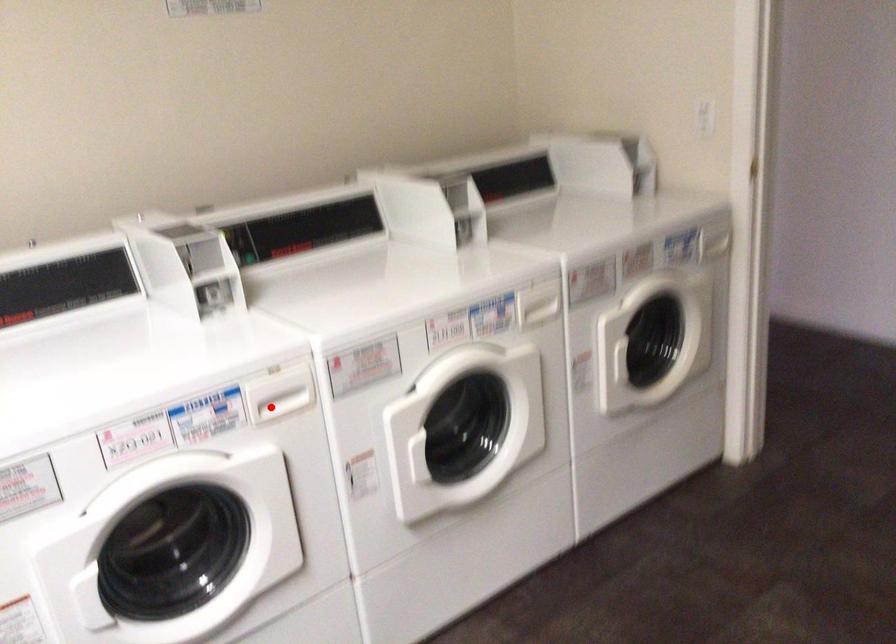
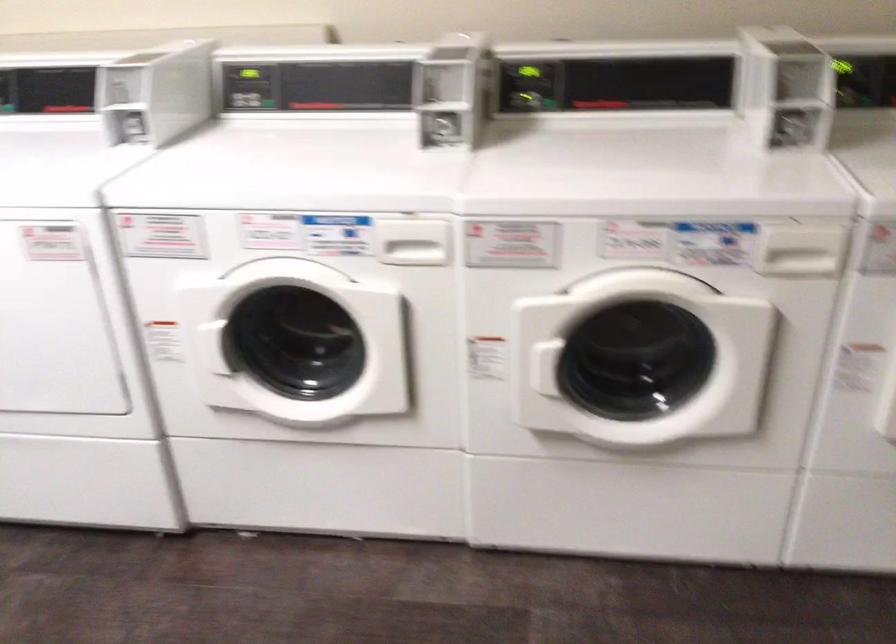
Where in the second image is the point corresponding to the highlighted location from the first image?

(409, 251)